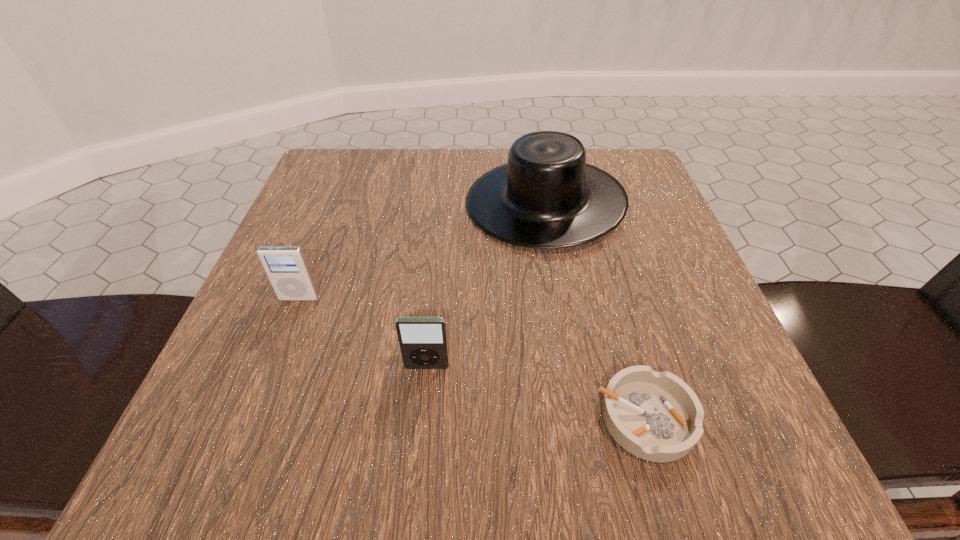
This screenshot has height=540, width=960. In order to click on free region that satisfies the following two spatial constraints: 1. on the front-facing side of the nearer iPod; 2. on the right side of the ashtray in this screenshot , I will do `click(421, 418)`.